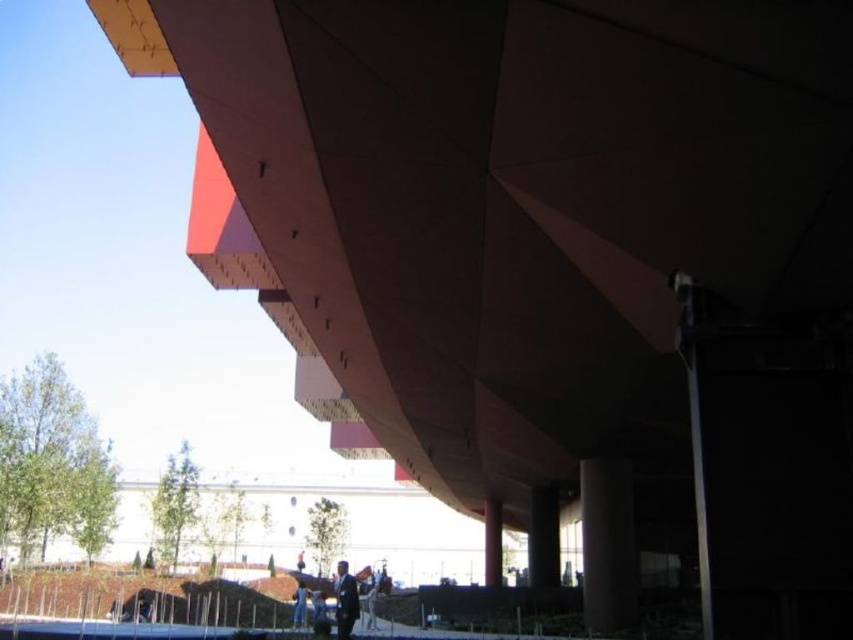
You are standing at the base of the white building in the background of the image. You see a point labeled as point (x=543, y=536). What object is located at this point?

The point (x=543, y=536) marks the location of the black smooth pillar at lower center.